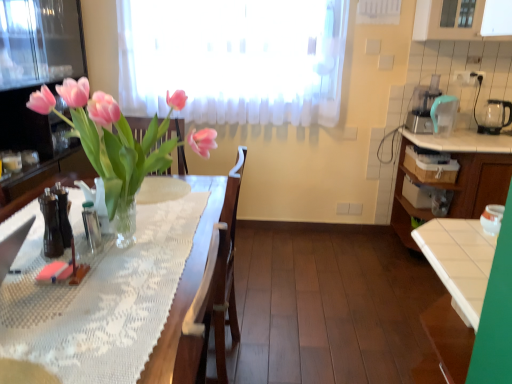
Identify the location of white glossy cabinet at right. (454, 186).

Measure the distance between point (x=407, y=218) and camera.

A distance of 3.15 meters exists between point (x=407, y=218) and camera.

What do you see at coordinates (492, 219) in the screenshot? The image size is (512, 384). I see `white glossy jar at right, positioned as the 3th appliance in top-to-bottom order` at bounding box center [492, 219].

Identify the location of white glossy cabinet at right. The image size is (512, 384). (454, 186).

Can you confirm if white glossy cabinet at right is wider than teal plastic blender at upper right, which ranks as the second appliance in top-to-bottom order?

Correct, the width of white glossy cabinet at right exceeds that of teal plastic blender at upper right, which ranks as the second appliance in top-to-bottom order.

Would you say white glossy cabinet at right is inside or outside teal plastic blender at upper right, which ranks as the second appliance in top-to-bottom order?

white glossy cabinet at right lies outside teal plastic blender at upper right, which ranks as the second appliance in top-to-bottom order.

From a real-world perspective, between white glossy cabinet at right and teal plastic blender at upper right, marked as the 2th appliance in a back-to-front arrangement, who is vertically lower?

white glossy cabinet at right is physically lower.

Can you confirm if white glossy cabinet at right is positioned to the left of teal plastic blender at upper right, which is the 2th appliance in right-to-left order?

In fact, white glossy cabinet at right is to the right of teal plastic blender at upper right, which is the 2th appliance in right-to-left order.

From a real-world perspective, is teal plastic blender at upper right, marked as the second appliance in a bottom-to-top arrangement, on transparent glass kettle at right, arranged as the 1th appliance when viewed from the right?

Yes, from a real-world perspective, teal plastic blender at upper right, marked as the second appliance in a bottom-to-top arrangement, is on top of transparent glass kettle at right, arranged as the 1th appliance when viewed from the right.

From the image's perspective, is teal plastic blender at upper right, which ranks as the second appliance in top-to-bottom order, above transparent glass kettle at right, the 3th appliance in the bottom-to-top sequence?

No, from the image's perspective, teal plastic blender at upper right, which ranks as the second appliance in top-to-bottom order, is not on top of transparent glass kettle at right, the 3th appliance in the bottom-to-top sequence.

Are teal plastic blender at upper right, which ranks as the second appliance in top-to-bottom order, and transparent glass kettle at right, marked as the third appliance in a left-to-right arrangement, far apart?

No, teal plastic blender at upper right, which ranks as the second appliance in top-to-bottom order, is not far away from transparent glass kettle at right, marked as the third appliance in a left-to-right arrangement.

Between point (454, 98) and point (482, 130), which one is positioned in front?

The point (454, 98) is in front.

Is teal plastic blender at upper right, marked as the 2th appliance in a back-to-front arrangement, at the right side of white glossy jar at right, which is the first appliance from bottom to top?

Yes.

Is teal plastic blender at upper right, marked as the second appliance in a bottom-to-top arrangement, in contact with white glossy jar at right, which is the first appliance from bottom to top?

teal plastic blender at upper right, marked as the second appliance in a bottom-to-top arrangement, is not next to white glossy jar at right, which is the first appliance from bottom to top, and they're not touching.

Is teal plastic blender at upper right, marked as the second appliance in a bottom-to-top arrangement, positioned with its back to white glossy jar at right, positioned as the 3th appliance in top-to-bottom order?

That's not correct — teal plastic blender at upper right, marked as the second appliance in a bottom-to-top arrangement, is not looking away from white glossy jar at right, positioned as the 3th appliance in top-to-bottom order.

Is white glossy cabinet at right touching transparent glass kettle at right, which is the first appliance in back-to-front order?

No, white glossy cabinet at right is not with transparent glass kettle at right, which is the first appliance in back-to-front order.

Which is more to the left, white glossy cabinet at right or transparent glass kettle at right, arranged as the 1th appliance when viewed from the right?

white glossy cabinet at right.

How much distance is there between white glossy cabinet at right and transparent glass kettle at right, the 3th appliance when ordered from front to back?

A distance of 24.70 inches exists between white glossy cabinet at right and transparent glass kettle at right, the 3th appliance when ordered from front to back.

Based on the photo, is white glossy cabinet at right positioned beyond the bounds of transparent glass kettle at right, which is the first appliance in back-to-front order?

Yes, white glossy cabinet at right is outside of transparent glass kettle at right, which is the first appliance in back-to-front order.

Can you confirm if teal plastic blender at upper right, which ranks as the second appliance in top-to-bottom order, is thinner than white glossy cabinet at right?

Correct, the width of teal plastic blender at upper right, which ranks as the second appliance in top-to-bottom order, is less than that of white glossy cabinet at right.

Consider the image. Is teal plastic blender at upper right, which ranks as the second appliance in top-to-bottom order, at the left side of white glossy cabinet at right?

Correct, you'll find teal plastic blender at upper right, which ranks as the second appliance in top-to-bottom order, to the left of white glossy cabinet at right.

From a real-world perspective, does teal plastic blender at upper right, which ranks as the second appliance in top-to-bottom order, stand above white glossy cabinet at right?

Yes, from a real-world perspective, teal plastic blender at upper right, which ranks as the second appliance in top-to-bottom order, is on top of white glossy cabinet at right.

Can you tell me how much transparent glass kettle at right, arranged as the 1th appliance when viewed from the right, and white glossy jar at right, marked as the first appliance in a front-to-back arrangement, differ in facing direction?

transparent glass kettle at right, arranged as the 1th appliance when viewed from the right, and white glossy jar at right, marked as the first appliance in a front-to-back arrangement, are facing 180 degrees away from each other.

From a real-world perspective, who is located higher, transparent glass kettle at right, the 3th appliance in the bottom-to-top sequence, or white glossy jar at right, positioned as the 3th appliance in top-to-bottom order?

transparent glass kettle at right, the 3th appliance in the bottom-to-top sequence, from a real-world perspective.

Is transparent glass kettle at right, which is the first appliance in back-to-front order, in front of white glossy jar at right, positioned as the 3th appliance in top-to-bottom order?

No, the depth of transparent glass kettle at right, which is the first appliance in back-to-front order, is greater than that of white glossy jar at right, positioned as the 3th appliance in top-to-bottom order.

From the image's perspective, is white glossy cabinet at right located above white glossy jar at right, the first appliance positioned from the left?

Indeed, from the image's perspective, white glossy cabinet at right is shown above white glossy jar at right, the first appliance positioned from the left.

Which point is more distant from viewer, (489,169) or (488,222)?

The point (489,169) is more distant.

Between white glossy cabinet at right and white glossy jar at right, which ranks as the third appliance in right-to-left order, which one appears on the left side from the viewer's perspective?

white glossy jar at right, which ranks as the third appliance in right-to-left order.

From a real-world perspective, is white glossy cabinet at right above or below white glossy jar at right, the first appliance positioned from the left?

white glossy cabinet at right is below white glossy jar at right, the first appliance positioned from the left.

Identify the location of cabinetry lying below the teal plastic blender at upper right, which is the 2th appliance in front-to-back order (from the image's perspective). [454, 186].

The image size is (512, 384). Find the location of `the 1st appliance to the left when counting from the transparent glass kettle at right, the 3th appliance in the bottom-to-top sequence`. the 1st appliance to the left when counting from the transparent glass kettle at right, the 3th appliance in the bottom-to-top sequence is located at coordinates (443, 114).

Based on their spatial positions, is teal plastic blender at upper right, marked as the 2th appliance in a back-to-front arrangement, or white glossy cabinet at right closer to white glossy jar at right, which is the first appliance from bottom to top?

Based on the image, white glossy cabinet at right appears to be nearer to white glossy jar at right, which is the first appliance from bottom to top.

When comparing their distances from transparent glass kettle at right, which is the first appliance in back-to-front order, does white glossy cabinet at right or white glossy jar at right, marked as the first appliance in a front-to-back arrangement, seem closer?

The object closer to transparent glass kettle at right, which is the first appliance in back-to-front order, is white glossy cabinet at right.

When comparing their distances from white glossy jar at right, which ranks as the third appliance in right-to-left order, does transparent glass kettle at right, the 1th appliance positioned from the top, or white glossy cabinet at right seem closer?

white glossy cabinet at right lies closer to white glossy jar at right, which ranks as the third appliance in right-to-left order, than the other object.

Consider the image. Which object lies further to the anchor point white glossy cabinet at right, teal plastic blender at upper right, acting as the second appliance starting from the left, or white glossy jar at right, the first appliance positioned from the left?

Based on the image, white glossy jar at right, the first appliance positioned from the left, appears to be further to white glossy cabinet at right.

Looking at the image, which one is located further to transparent glass kettle at right, the 1th appliance positioned from the top, teal plastic blender at upper right, marked as the 2th appliance in a back-to-front arrangement, or white glossy cabinet at right?

white glossy cabinet at right lies further to transparent glass kettle at right, the 1th appliance positioned from the top, than the other object.

Based on the photo, estimate the real-world distances between objects in this image. Which object is closer to teal plastic blender at upper right, which ranks as the second appliance in top-to-bottom order, transparent glass kettle at right, the 1th appliance positioned from the top, or white glossy cabinet at right?

Based on the image, transparent glass kettle at right, the 1th appliance positioned from the top, appears to be nearer to teal plastic blender at upper right, which ranks as the second appliance in top-to-bottom order.

Estimate the real-world distances between objects in this image. Which object is further from white glossy jar at right, positioned as the 3th appliance in top-to-bottom order, transparent glass kettle at right, the 3th appliance in the bottom-to-top sequence, or teal plastic blender at upper right, which ranks as the second appliance in top-to-bottom order?

transparent glass kettle at right, the 3th appliance in the bottom-to-top sequence, is positioned further to the anchor white glossy jar at right, positioned as the 3th appliance in top-to-bottom order.

In the scene shown: Considering their positions, is white glossy jar at right, which ranks as the third appliance in right-to-left order, positioned further to transparent glass kettle at right, the 1th appliance positioned from the top, than teal plastic blender at upper right, which ranks as the second appliance in top-to-bottom order?

white glossy jar at right, which ranks as the third appliance in right-to-left order.

Where is `appliance between transparent glass kettle at right, marked as the third appliance in a left-to-right arrangement, and white glossy cabinet at right in the up-down direction`? appliance between transparent glass kettle at right, marked as the third appliance in a left-to-right arrangement, and white glossy cabinet at right in the up-down direction is located at coordinates (443, 114).

Locate an element on the screen. appliance between white glossy jar at right, marked as the first appliance in a front-to-back arrangement, and transparent glass kettle at right, marked as the third appliance in a left-to-right arrangement, in the front-back direction is located at coordinates (443, 114).

This screenshot has height=384, width=512. I want to click on cabinetry positioned between white glossy jar at right, which appears as the 3th appliance when viewed from the back, and teal plastic blender at upper right, acting as the second appliance starting from the left, from near to far, so click(454, 186).

At what (x,y) coordinates should I click in order to perform the action: click on cabinetry between white glossy jar at right, which ranks as the third appliance in right-to-left order, and transparent glass kettle at right, which is the first appliance in back-to-front order, from front to back. Please return your answer as a coordinate pair (x, y). The width and height of the screenshot is (512, 384). Looking at the image, I should click on (454, 186).